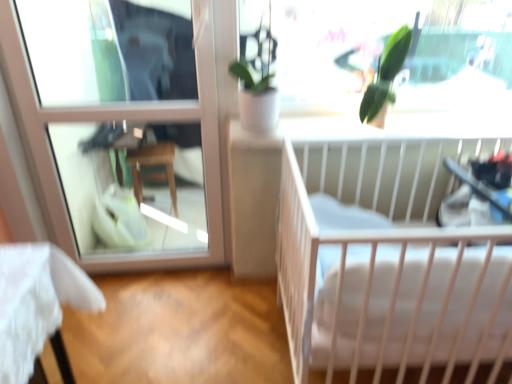
At what (x,y) coordinates should I click in order to perform the action: click on clear glass window at upper left. Please return your answer as a coordinate pair (x, y). The width and height of the screenshot is (512, 384). Looking at the image, I should click on (124, 120).

What do you see at coordinates (124, 120) in the screenshot? Image resolution: width=512 pixels, height=384 pixels. I see `clear glass window at upper left` at bounding box center [124, 120].

Identify the location of black plastic baby carriage at right. (472, 202).

Considering the sizes of objects white matte crib at right and clear glass window at upper left in the image provided, who is taller, white matte crib at right or clear glass window at upper left?

clear glass window at upper left is taller.

Can you confirm if white matte crib at right is smaller than clear glass window at upper left?

No.

From the image's perspective, which object appears higher, white matte crib at right or clear glass window at upper left?

From the image's view, clear glass window at upper left is above.

This screenshot has height=384, width=512. Find the location of `infant bed lying on the right of green leafy plant at upper center`. infant bed lying on the right of green leafy plant at upper center is located at coordinates (387, 261).

Is green leafy plant at upper center turned away from white matte crib at right?

No.

From the image's perspective, is green leafy plant at upper center positioned above or below white matte crib at right?

From the image's perspective, green leafy plant at upper center appears above white matte crib at right.

Considering the relative sizes of green leafy plant at upper center and white matte crib at right in the image provided, is green leafy plant at upper center shorter than white matte crib at right?

Indeed, green leafy plant at upper center has a lesser height compared to white matte crib at right.

How many degrees apart are the facing directions of clear glass window at upper left and green leafy plant at upper center?

They differ by 0.487 degrees in their facing directions.

How much distance is there between clear glass window at upper left and green leafy plant at upper center?

clear glass window at upper left is 91.32 centimeters away from green leafy plant at upper center.

From the image's perspective, between clear glass window at upper left and green leafy plant at upper center, which one is located above?

green leafy plant at upper center appears higher in the image.

Is clear glass window at upper left situated inside green leafy plant at upper center or outside?

clear glass window at upper left lies outside green leafy plant at upper center.

Based on the photo, measure the distance between white matte crib at right and black plastic baby carriage at right.

A distance of 14.01 inches exists between white matte crib at right and black plastic baby carriage at right.

Considering the sizes of objects white matte crib at right and black plastic baby carriage at right in the image provided, who is taller, white matte crib at right or black plastic baby carriage at right?

white matte crib at right is taller.

Considering the positions of points (302, 259) and (486, 213), is point (302, 259) closer to camera compared to point (486, 213)?

Yes, it is.

From a real-world perspective, is white matte crib at right physically below black plastic baby carriage at right?

Yes, from a real-world perspective, white matte crib at right is below black plastic baby carriage at right.

Is the depth of white matte crib at right greater than that of white soft mattress at center?

No, white matte crib at right is closer to the camera.

Looking at this image, from the image's perspective, is white matte crib at right positioned above or below white soft mattress at center?

white matte crib at right is above white soft mattress at center.

Is white matte crib at right taller than white soft mattress at center?

Indeed, white matte crib at right has a greater height compared to white soft mattress at center.

Considering the positions of objects green leafy plant at upper center and black plastic baby carriage at right in the image provided, who is more to the left, green leafy plant at upper center or black plastic baby carriage at right?

green leafy plant at upper center is more to the left.

Where is `window screen above the black plastic baby carriage at right (from the image's perspective)`? This screenshot has width=512, height=384. window screen above the black plastic baby carriage at right (from the image's perspective) is located at coordinates (381, 52).

Based on the photo, from a real-world perspective, is green leafy plant at upper center positioned above or below black plastic baby carriage at right?

From a real-world perspective, green leafy plant at upper center is physically above black plastic baby carriage at right.

Between green leafy plant at upper center and black plastic baby carriage at right, which one has larger width?

With larger width is black plastic baby carriage at right.

Looking at this image, which of these two, black plastic baby carriage at right or white matte crib at right, is bigger?

With larger size is white matte crib at right.

Between black plastic baby carriage at right and white matte crib at right, which one has larger width?

white matte crib at right.

Image resolution: width=512 pixels, height=384 pixels. In order to click on infant bed lying in front of the black plastic baby carriage at right in this screenshot , I will do `click(387, 261)`.

Which is closer to the camera, [441,225] or [352,244]?

Clearly, point [441,225] is more distant from the camera than point [352,244].

You are a GUI agent. You are given a task and a screenshot of the screen. Output one action in this format:
    pyautogui.click(x=<x>, y=<y>)
    Task: Click on the infant bed below the clear glass window at upper left (from the image's perspective)
    Image resolution: width=512 pixels, height=384 pixels.
    Given the screenshot: What is the action you would take?
    pyautogui.click(x=387, y=261)

You are a GUI agent. You are given a task and a screenshot of the screen. Output one action in this format:
    pyautogui.click(x=<x>, y=<y>)
    Task: Click on the infant bed on the right of green leafy plant at upper center
    Image resolution: width=512 pixels, height=384 pixels.
    Given the screenshot: What is the action you would take?
    pyautogui.click(x=387, y=261)

From the image, which object appears to be nearer to green leafy plant at upper center, clear glass window at upper left or white soft mattress at center?

Based on the image, clear glass window at upper left appears to be nearer to green leafy plant at upper center.

When comparing their distances from white soft mattress at center, does white matte crib at right or green leafy plant at upper center seem closer?

The object closer to white soft mattress at center is white matte crib at right.

Based on their spatial positions, is white soft mattress at center or clear glass window at upper left further from white matte crib at right?

clear glass window at upper left.

When comparing their distances from black plastic baby carriage at right, does green leafy plant at upper center or white matte crib at right seem closer?

Based on the image, white matte crib at right appears to be nearer to black plastic baby carriage at right.

From the image, which object appears to be farther from white soft mattress at center, white matte crib at right or black plastic baby carriage at right?

black plastic baby carriage at right lies further to white soft mattress at center than the other object.

Looking at the image, which one is located further to white matte crib at right, black plastic baby carriage at right or green leafy plant at upper center?

green leafy plant at upper center.

From the picture: Based on their spatial positions, is white matte crib at right or green leafy plant at upper center further from clear glass window at upper left?

Based on the image, white matte crib at right appears to be further to clear glass window at upper left.

Looking at this image, considering their positions, is green leafy plant at upper center positioned closer to white soft mattress at center than black plastic baby carriage at right?

black plastic baby carriage at right is positioned closer to the anchor white soft mattress at center.

The height and width of the screenshot is (384, 512). Identify the location of baby carriage that lies between green leafy plant at upper center and white matte crib at right from top to bottom. (472, 202).

Locate an element on the screen. The image size is (512, 384). mattress between clear glass window at upper left and white matte crib at right is located at coordinates (379, 302).

Locate an element on the screen. This screenshot has width=512, height=384. window screen situated between clear glass window at upper left and black plastic baby carriage at right from left to right is located at coordinates (381, 52).

The image size is (512, 384). In order to click on infant bed situated between clear glass window at upper left and black plastic baby carriage at right from left to right in this screenshot , I will do `click(387, 261)`.